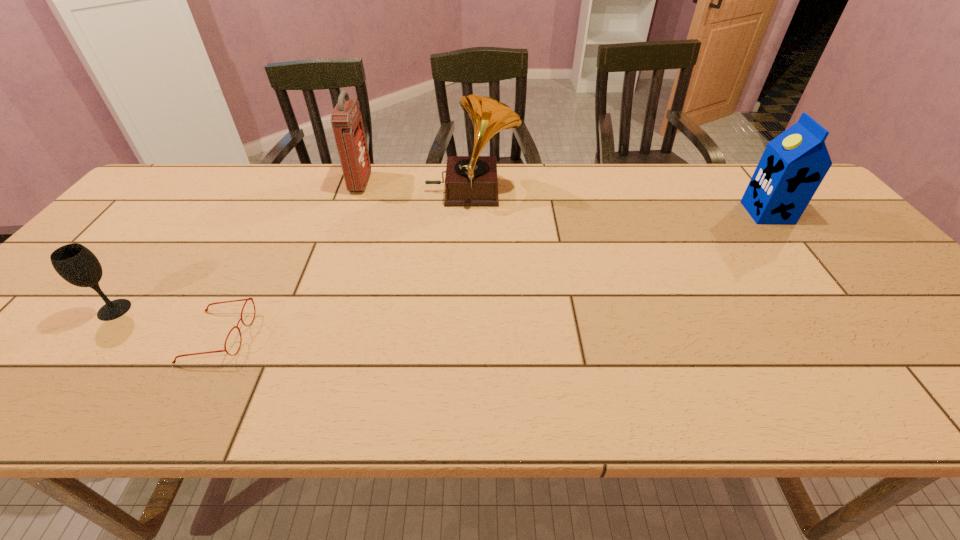
I want to click on the second object from right to left, so click(x=472, y=180).

Image resolution: width=960 pixels, height=540 pixels. Identify the location of the first-aid kit. (346, 119).

This screenshot has width=960, height=540. I want to click on the rightmost object, so (x=793, y=165).

Find the location of `the leftmost object`. the leftmost object is located at coordinates (x=75, y=263).

At what (x,y) coordinates should I click in order to perform the action: click on the second shortest object. Please return your answer as a coordinate pair (x, y). This screenshot has height=540, width=960. Looking at the image, I should click on (75, 263).

Locate an element on the screen. The width and height of the screenshot is (960, 540). spectacles is located at coordinates (247, 299).

Locate an element on the screen. Image resolution: width=960 pixels, height=540 pixels. the shortest object is located at coordinates (247, 299).

I want to click on vacant space situated 0.400m from the horn of the phonograph record, so click(648, 193).

Where is `vacant space situated on the front-facing side of the first-aid kit`? The height and width of the screenshot is (540, 960). vacant space situated on the front-facing side of the first-aid kit is located at coordinates [x=473, y=183].

Where is `blank area located 0.100m with the cap open on the rightmost object`? The height and width of the screenshot is (540, 960). blank area located 0.100m with the cap open on the rightmost object is located at coordinates (713, 213).